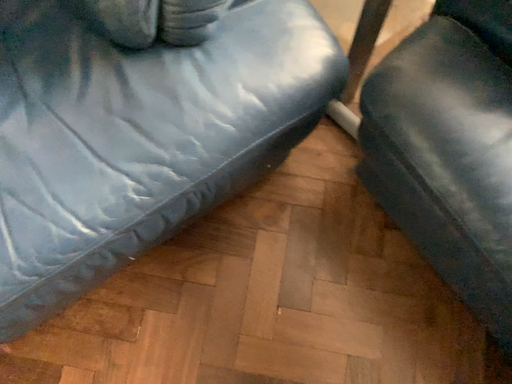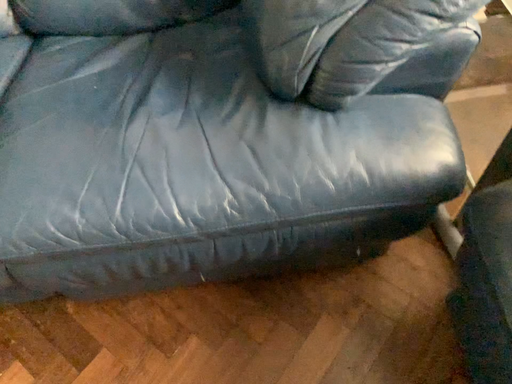
Question: How did the camera likely rotate when shooting the video?

Choices:
 (A) rotated downward
 (B) rotated upward

Answer: (B)